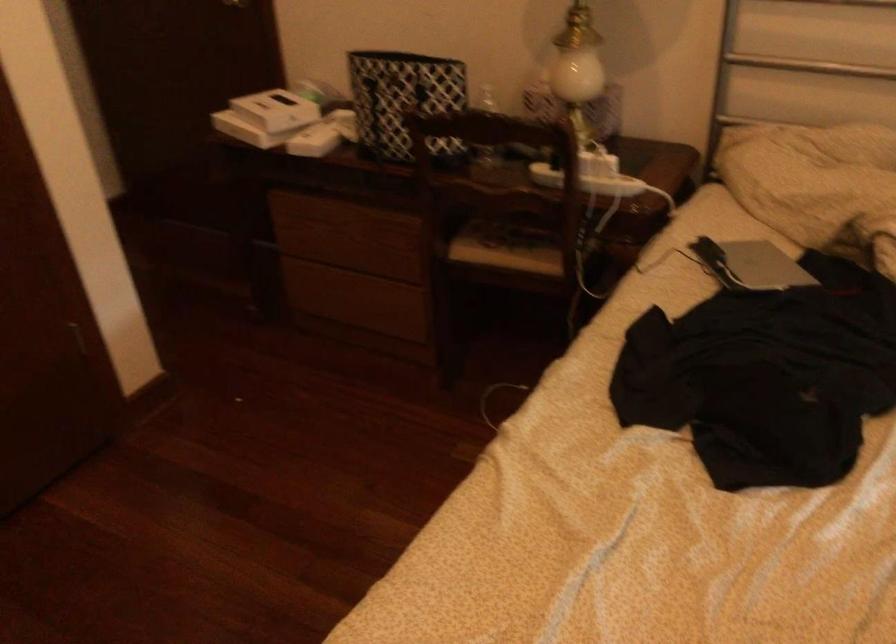
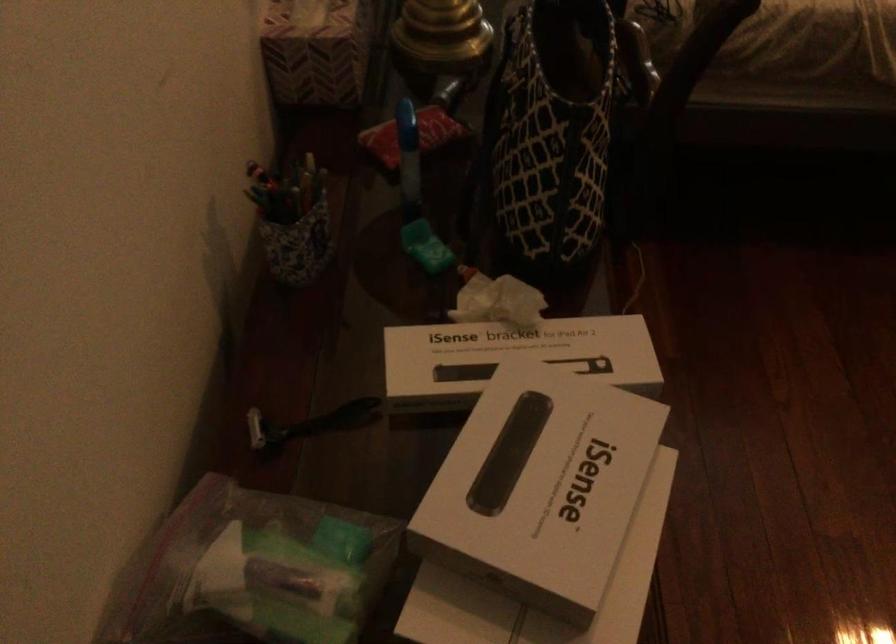
Where in the second image is the point corresponding to [264,100] from the first image?

(540, 486)